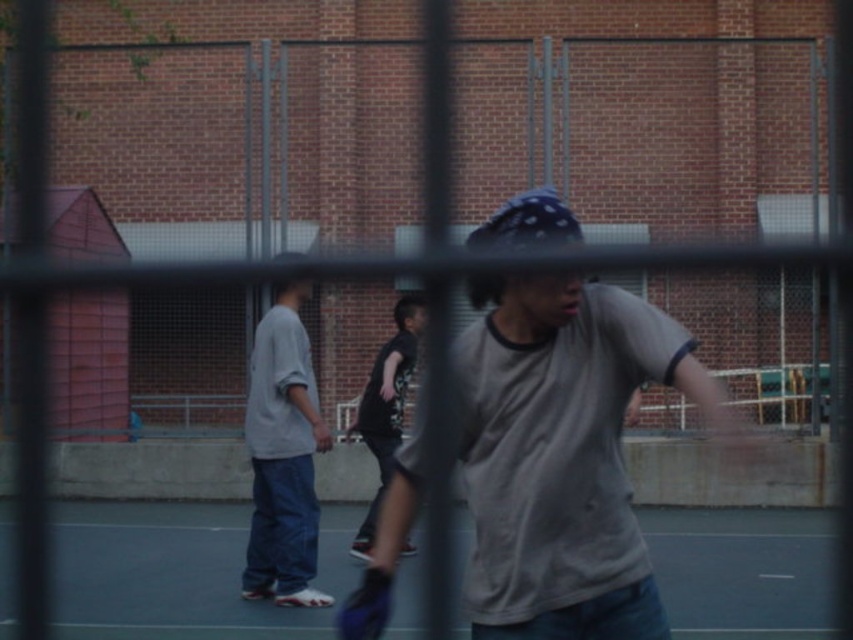
Does point (537, 298) come in front of point (161, 547)?

Yes, point (537, 298) is in front of point (161, 547).

Does gray matte t-shirt at center have a greater width compared to smooth asphalt court at center?

Correct, the width of gray matte t-shirt at center exceeds that of smooth asphalt court at center.

Identify the location of gray matte t-shirt at center. (563, 452).

Is smooth asphalt court at center shorter than dark gray t-shirt at center?

Yes, smooth asphalt court at center is shorter than dark gray t-shirt at center.

The image size is (853, 640). Describe the element at coordinates (161, 573) in the screenshot. I see `smooth asphalt court at center` at that location.

Who is more forward, (70, 632) or (399, 342)?

Positioned in front is point (70, 632).

At what (x,y) coordinates should I click in order to perform the action: click on smooth asphalt court at center. Please return your answer as a coordinate pair (x, y). This screenshot has width=853, height=640. Looking at the image, I should click on (161, 573).

Is point (265, 538) positioned before point (370, 532)?

Yes.

The width and height of the screenshot is (853, 640). Describe the element at coordinates (283, 456) in the screenshot. I see `light gray cotton shirt at left` at that location.

Locate an element on the screen. light gray cotton shirt at left is located at coordinates (283, 456).